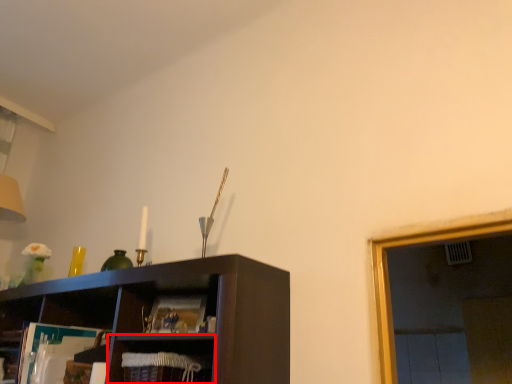
Question: Where is cabinet (annotated by the red box) located in relation to magazine in the image?

Choices:
 (A) right
 (B) left

Answer: (B)